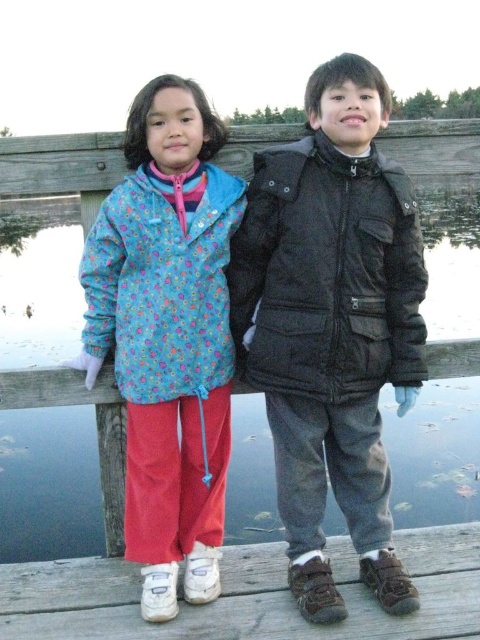
Is point (151, 602) positioned after point (466, 579)?

No, (151, 602) is closer to viewer.

This screenshot has height=640, width=480. In order to click on floral fabric jacket at center in this screenshot , I will do `click(168, 333)`.

Is the position of matte black jacket at center more distant than that of floral fabric jacket at center?

That is False.

Who is more distant from viewer, (350, 337) or (175, 424)?

The point (175, 424) is more distant.

The width and height of the screenshot is (480, 640). In order to click on matte black jacket at center in this screenshot , I will do `click(333, 324)`.

Can you confirm if matte black jacket at center is positioned above wooden dock at lower center?

Yes, matte black jacket at center is above wooden dock at lower center.

Is matte black jacket at center taller than wooden dock at lower center?

Yes, matte black jacket at center is taller than wooden dock at lower center.

Between point (345, 284) and point (425, 532), which one is positioned behind?

The point (425, 532) is behind.

You are a GUI agent. You are given a task and a screenshot of the screen. Output one action in this format:
    pyautogui.click(x=<x>, y=<y>)
    Task: Click on the matte black jacket at center
    Image resolution: width=480 pixels, height=640 pixels.
    Given the screenshot: What is the action you would take?
    pyautogui.click(x=333, y=324)